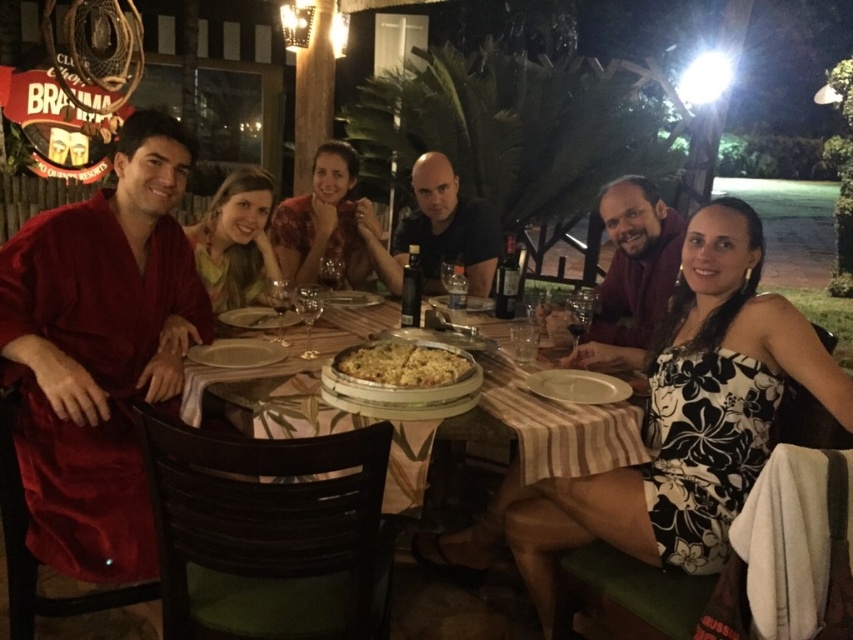
Question: Which of the following is the farthest from the observer?

Choices:
 (A) white ceramic platter at lower center
 (B) matte red robe at left
 (C) wooden table at center

Answer: (A)

Question: Which of the following is the closest to the observer?

Choices:
 (A) black matte shirt at center
 (B) matte yellow scarf at center
 (C) white ceramic platter at lower center

Answer: (C)

Question: Does matte yellow scarf at center appear over golden crispy pizza at center?

Choices:
 (A) no
 (B) yes

Answer: (B)

Question: Is black matte shirt at center below white ceramic platter at lower center?

Choices:
 (A) no
 (B) yes

Answer: (A)

Question: Considering the real-world distances, which object is closest to the golden crispy pizza at center?

Choices:
 (A) matte yellow scarf at center
 (B) matte red robe at left
 (C) floral dress at center
 (D) black matte shirt at center

Answer: (B)

Question: Does matte red robe at left lie behind wooden table at center?

Choices:
 (A) yes
 (B) no

Answer: (A)